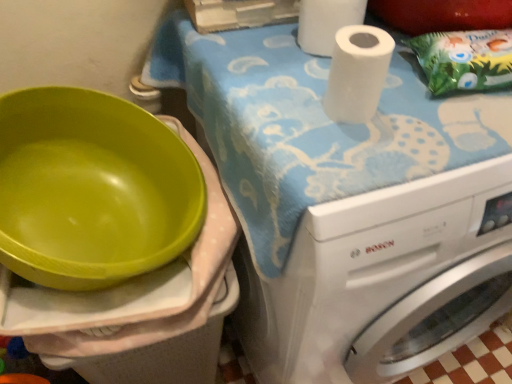
Question: Considering the relative sizes of green paper bag at upper right and white matte paper towel at upper right, which is the 2th paper towel in bottom-to-top order, in the image provided, is green paper bag at upper right bigger than white matte paper towel at upper right, which is the 2th paper towel in bottom-to-top order,?

Choices:
 (A) yes
 (B) no

Answer: (A)

Question: Is green paper bag at upper right facing away from white matte paper towel at upper right, the first paper towel in the top-to-bottom sequence?

Choices:
 (A) yes
 (B) no

Answer: (B)

Question: Can you confirm if green paper bag at upper right is wider than white matte paper towel at upper right, the first paper towel in the top-to-bottom sequence?

Choices:
 (A) yes
 (B) no

Answer: (A)

Question: Is green paper bag at upper right oriented towards white matte paper towel at upper right, the first paper towel in the top-to-bottom sequence?

Choices:
 (A) yes
 (B) no

Answer: (B)

Question: Considering the relative sizes of green paper bag at upper right and white matte paper towel at upper right, the first paper towel in the top-to-bottom sequence, in the image provided, is green paper bag at upper right shorter than white matte paper towel at upper right, the first paper towel in the top-to-bottom sequence,?

Choices:
 (A) yes
 (B) no

Answer: (A)

Question: Considering the positions of white matte paper towel at upper center, the 2th paper towel in the back-to-front sequence, and white matte paper towel at upper right, which appears as the 1th paper towel when viewed from the back, in the image, is white matte paper towel at upper center, the 2th paper towel in the back-to-front sequence, wider or thinner than white matte paper towel at upper right, which appears as the 1th paper towel when viewed from the back,?

Choices:
 (A) thin
 (B) wide

Answer: (A)

Question: Would you say white matte paper towel at upper center, the 2th paper towel in the back-to-front sequence, is to the left or to the right of white matte paper towel at upper right, which appears as the 1th paper towel when viewed from the back, in the picture?

Choices:
 (A) left
 (B) right

Answer: (B)

Question: Based on their sizes in the image, would you say white matte paper towel at upper center, the 2th paper towel from the top, is bigger or smaller than white matte paper towel at upper right, which appears as the 1th paper towel when viewed from the back?

Choices:
 (A) small
 (B) big

Answer: (A)

Question: Considering their positions, is white matte paper towel at upper center, the first paper towel ordered from the bottom, located in front of or behind white matte paper towel at upper right, which is the 2th paper towel in bottom-to-top order?

Choices:
 (A) behind
 (B) front

Answer: (B)

Question: From a real-world perspective, is green paper bag at upper right physically located above or below white matte paper towel at upper center, placed as the 1th paper towel when sorted from front to back?

Choices:
 (A) above
 (B) below

Answer: (B)

Question: In terms of height, does green paper bag at upper right look taller or shorter compared to white matte paper towel at upper center, the 2th paper towel from the top?

Choices:
 (A) short
 (B) tall

Answer: (A)

Question: Considering the positions of point (433, 79) and point (338, 117), is point (433, 79) closer or farther from the camera than point (338, 117)?

Choices:
 (A) closer
 (B) farther

Answer: (B)

Question: Is green paper bag at upper right wider or thinner than white matte paper towel at upper center, the first paper towel ordered from the bottom?

Choices:
 (A) wide
 (B) thin

Answer: (A)

Question: Considering their positions, is green paper bag at upper right located in front of or behind white glossy washing machine at upper right?

Choices:
 (A) front
 (B) behind

Answer: (B)

Question: Considering the relative positions of green paper bag at upper right and white glossy washing machine at upper right in the image provided, is green paper bag at upper right to the left or to the right of white glossy washing machine at upper right?

Choices:
 (A) left
 (B) right

Answer: (B)